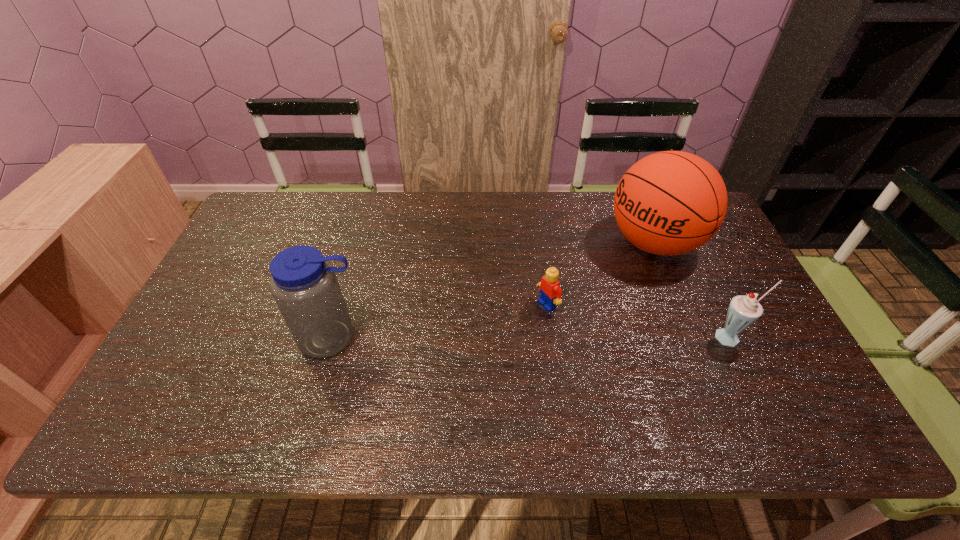
You are a GUI agent. You are given a task and a screenshot of the screen. Output one action in this format:
    pyautogui.click(x=<x>, y=<y>)
    Task: Click on the vacant space on the desktop that is between the leftmost object and the milkshake and is positioned on the side with logo of the basketball
    
    Given the screenshot: What is the action you would take?
    pyautogui.click(x=496, y=338)

The image size is (960, 540). In order to click on vacant space on the desktop that is between the water bottle and the third tallest object and is positioned on the face of the second object from left to right in this screenshot , I will do `click(487, 338)`.